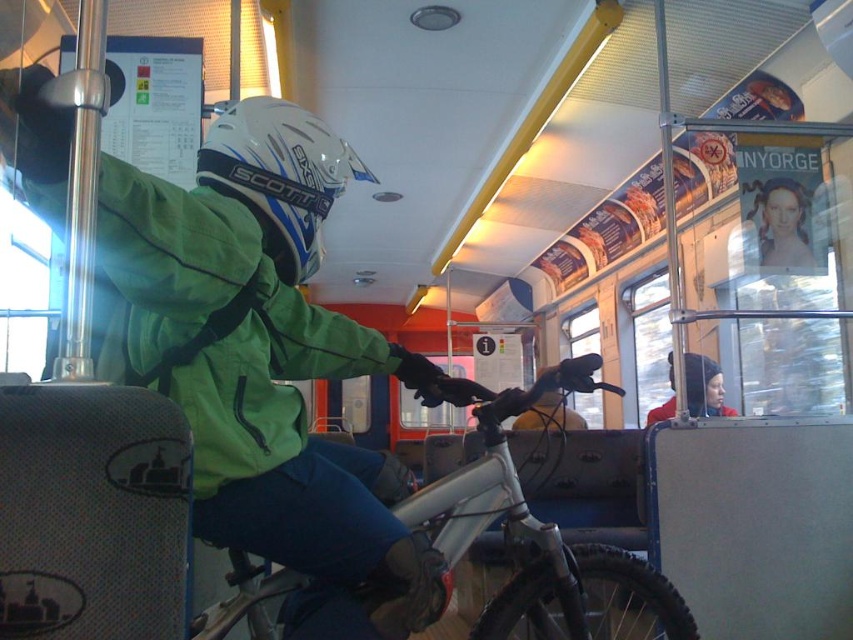
Does point (558, 369) come farther from viewer compared to point (753, 204)?

No, it is not.

The height and width of the screenshot is (640, 853). Find the location of `white matte bicycle at center`. white matte bicycle at center is located at coordinates (540, 541).

Is point (634, 600) closer to camera compared to point (247, 179)?

No, it is not.

Can you confirm if white matte bicycle at center is positioned to the left of white matte helmet at upper center?

No, white matte bicycle at center is not to the left of white matte helmet at upper center.

Between point (509, 513) and point (289, 118), which one is positioned behind?

Point (509, 513)

Identify the location of white matte bicycle at center. Image resolution: width=853 pixels, height=640 pixels. (540, 541).

Which of these two, green matte jacket at upper left or red woolen hat at upper right, stands shorter?

red woolen hat at upper right is shorter.

Is point (294, 260) positioned behind point (695, 388)?

No, (294, 260) is in front of (695, 388).

Identify the location of green matte jacket at upper left. This screenshot has width=853, height=640. (263, 356).